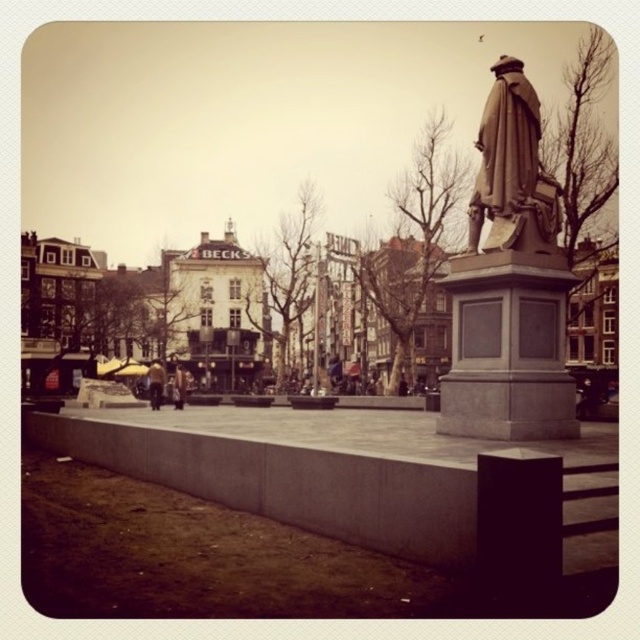
Between concrete at center and dark brown leather jacket at center, which one has less height?

Standing shorter between the two is dark brown leather jacket at center.

Can you confirm if concrete at center is bigger than dark brown leather jacket at center?

Correct, concrete at center is larger in size than dark brown leather jacket at center.

I want to click on concrete at center, so click(296, 467).

Is point (524, 86) more distant than point (177, 384)?

No.

Which is in front, point (502, 109) or point (173, 381)?

Positioned in front is point (502, 109).

Find the location of `bronze statue at center`. bronze statue at center is located at coordinates (512, 168).

Who is higher up, bronze statue at right or bronze statue at center?

bronze statue at center

Does point (502, 92) come in front of point (552, 204)?

That is False.

You are a GUI agent. You are given a task and a screenshot of the screen. Output one action in this format:
    pyautogui.click(x=<x>, y=<y>)
    Task: Click on the bronze statue at right
    
    Given the screenshot: What is the action you would take?
    pyautogui.click(x=509, y=284)